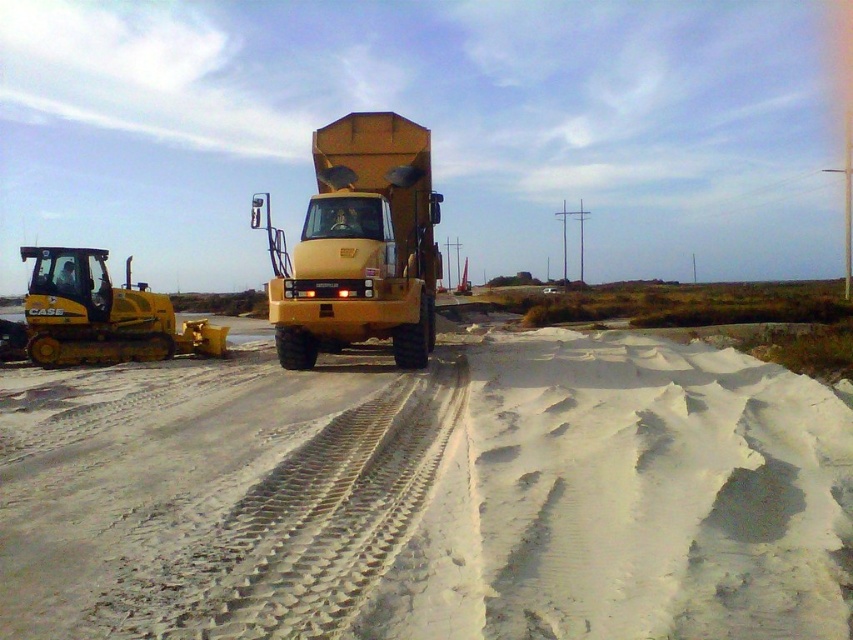
Question: Is yellow matte dump truck at center to the left of yellow rubber plow at left from the viewer's perspective?

Choices:
 (A) no
 (B) yes

Answer: (A)

Question: Can you confirm if yellow matte dump truck at center is thinner than yellow rubber plow at left?

Choices:
 (A) no
 (B) yes

Answer: (B)

Question: Which object appears farthest from the camera in this image?

Choices:
 (A) yellow rubber plow at left
 (B) yellow matte dump truck at center

Answer: (A)

Question: Does yellow matte dump truck at center appear under yellow rubber plow at left?

Choices:
 (A) no
 (B) yes

Answer: (A)